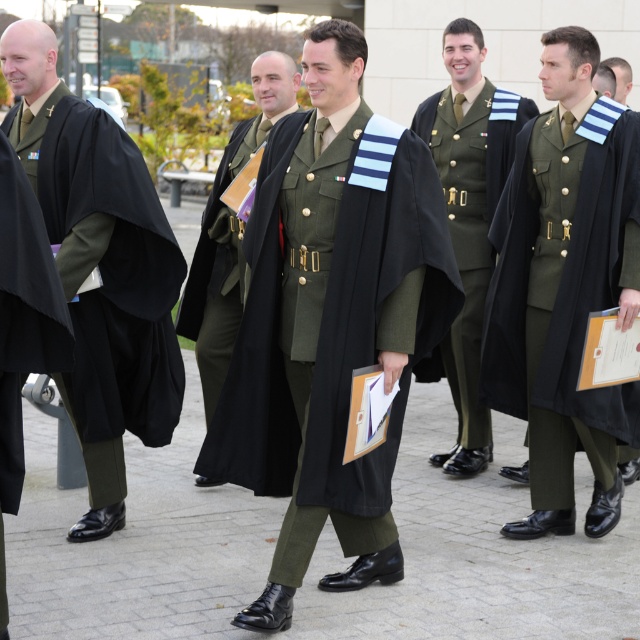
You are an event photographer at a military and academic ceremony. You need to capture a photo where the matte black graduation gown at center and the black matte cape at left are both clearly visible. Based on their positions, which object should you ensure is in the foreground to avoid being blocked?

The black matte cape at left should be in the foreground because the matte black graduation gown at center is located above it, so positioning the cape closer to the camera will prevent the gown from blocking it.

You are a photographer at the event. You need to capture a photo where the black matte cape at left is visible above the matte black hair at upper right. Is this possible given their current positions?

The black matte cape at left is located below matte black hair at upper right, so it is not possible to capture the black matte cape at left above the matte black hair at upper right in their current positions.